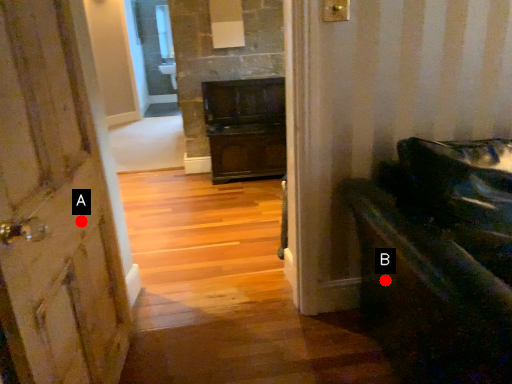
Question: Two points are circled on the image, labeled by A and B beside each circle. Which of the following is the closest to the observer?

Choices:
 (A) A is closer
 (B) B is closer

Answer: (A)